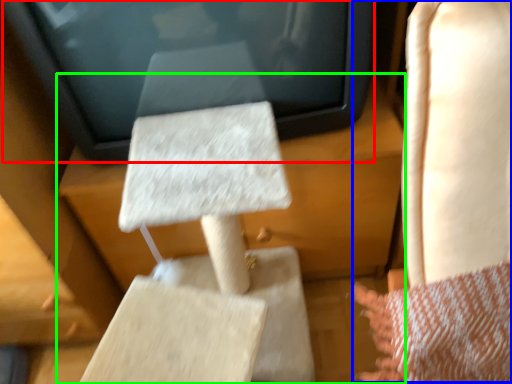
Question: Which object is positioned closest to electronic (highlighted by a red box)? Select from rocking chair (highlighted by a blue box) and furniture (highlighted by a green box).

Choices:
 (A) rocking chair
 (B) furniture

Answer: (B)